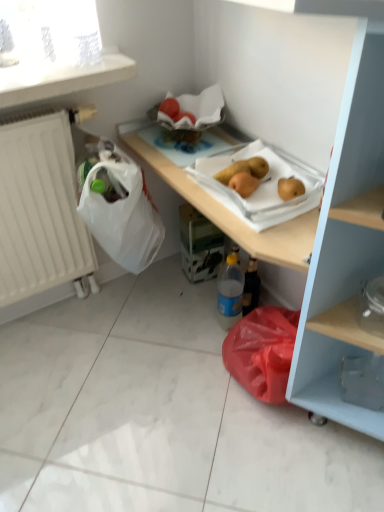
Where is `free space to the left of transparent plastic carton at center`? This screenshot has height=512, width=384. free space to the left of transparent plastic carton at center is located at coordinates (165, 273).